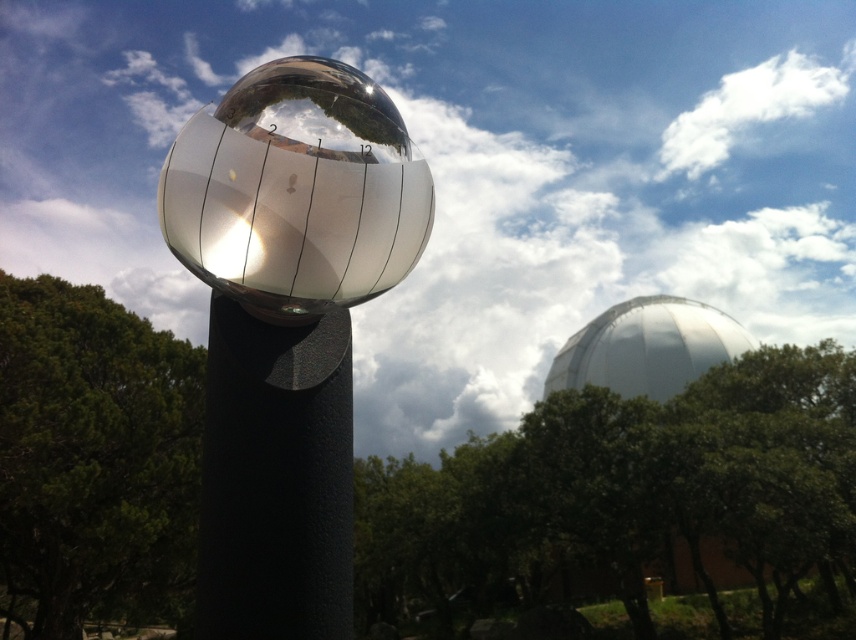
Can you confirm if shiny metallic sphere at center is smaller than white glossy dome at upper right?

Yes.

Does shiny metallic sphere at center have a lesser height compared to white glossy dome at upper right?

Yes, shiny metallic sphere at center is shorter than white glossy dome at upper right.

Between point (218, 109) and point (584, 328), which one is positioned in front?

Point (218, 109) is more forward.

Locate an element on the screen. shiny metallic sphere at center is located at coordinates [296, 192].

Does white fluffy cloud at upper center have a greater height compared to polished silver sphere at center?

Correct, white fluffy cloud at upper center is much taller as polished silver sphere at center.

Is white fluffy cloud at upper center shorter than polished silver sphere at center?

No, white fluffy cloud at upper center is not shorter than polished silver sphere at center.

Is point (120, 99) farther from camera compared to point (265, 381)?

That is True.

Find the location of a particular element. This screenshot has width=856, height=640. white fluffy cloud at upper center is located at coordinates (468, 172).

Which is below, green leafy tree at center or green leafy tree at lower left?

green leafy tree at center is below.

Can you confirm if green leafy tree at center is wider than green leafy tree at lower left?

Indeed, green leafy tree at center has a greater width compared to green leafy tree at lower left.

What are the coordinates of `green leafy tree at center` in the screenshot? It's located at (623, 499).

At what (x,y) coordinates should I click in order to perform the action: click on green leafy tree at center. Please return your answer as a coordinate pair (x, y). This screenshot has width=856, height=640. Looking at the image, I should click on (623, 499).